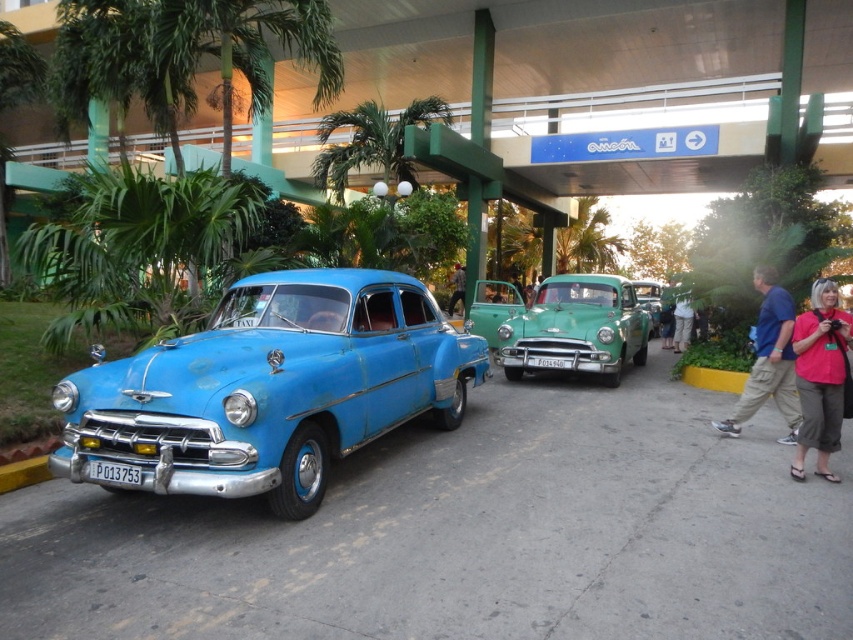
Question: Is green glossy car at center above blue cotton shirt at right?

Choices:
 (A) yes
 (B) no

Answer: (A)

Question: Estimate the real-world distances between objects in this image. Which object is farther from the matte blue car at center?

Choices:
 (A) blue cotton shirt at right
 (B) brown leather pants at lower right

Answer: (B)

Question: Considering the relative positions of brown leather pants at lower right and light brown leather jacket at center in the image provided, where is brown leather pants at lower right located with respect to light brown leather jacket at center?

Choices:
 (A) right
 (B) left

Answer: (A)

Question: Does matte blue car at center appear on the right side of light brown leather jacket at center?

Choices:
 (A) yes
 (B) no

Answer: (B)

Question: Considering the real-world distances, which object is closest to the pink fabric shirt at right?

Choices:
 (A) brown leather pants at lower right
 (B) green glossy car at center
 (C) matte blue car at center
 (D) blue cotton shirt at right

Answer: (D)

Question: Which object appears closest to the camera in this image?

Choices:
 (A) green glossy car at center
 (B) pink fabric shirt at right
 (C) blue cotton shirt at right

Answer: (B)